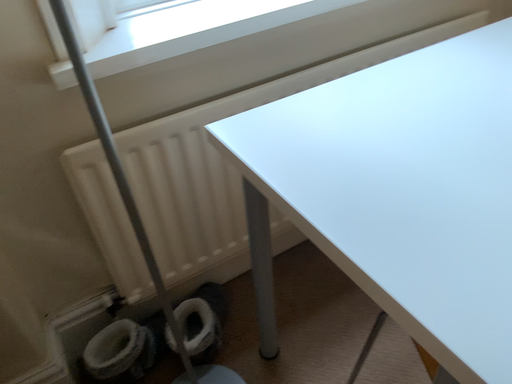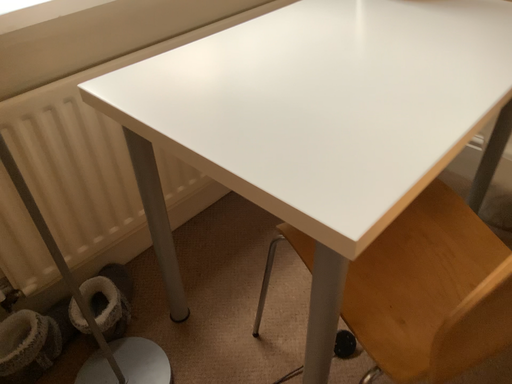
Question: How did the camera likely rotate when shooting the video?

Choices:
 (A) rotated right
 (B) rotated left

Answer: (A)